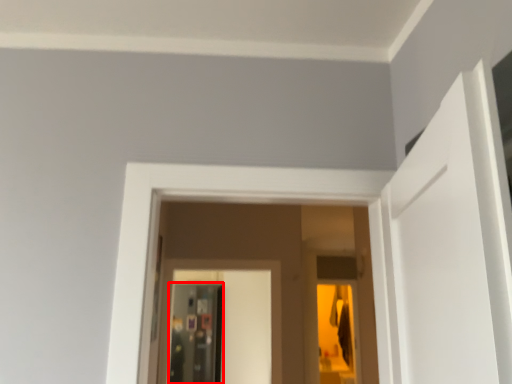
Question: From the image's perspective, where is screen door (annotated by the red box) located in relation to screen door in the image?

Choices:
 (A) below
 (B) above

Answer: (A)